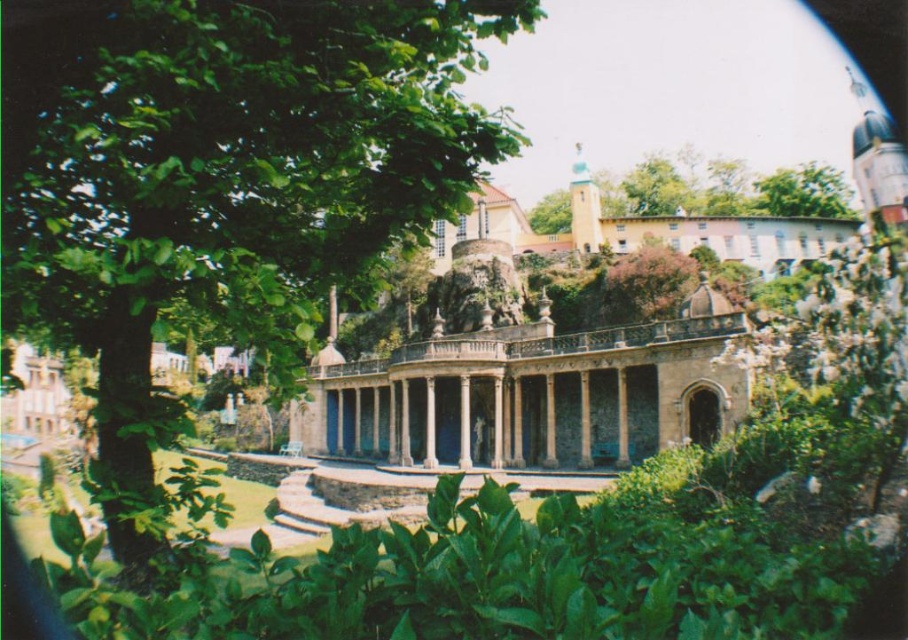
Is point (60, 84) behind point (757, 179)?

No.

Measure the distance between green leafy tree at center and green leafy tree at upper right.

green leafy tree at center is 115.10 meters from green leafy tree at upper right.

Is point (147, 19) closer to viewer compared to point (832, 205)?

Yes, point (147, 19) is closer to viewer.

I want to click on green leafy tree at center, so pos(225,166).